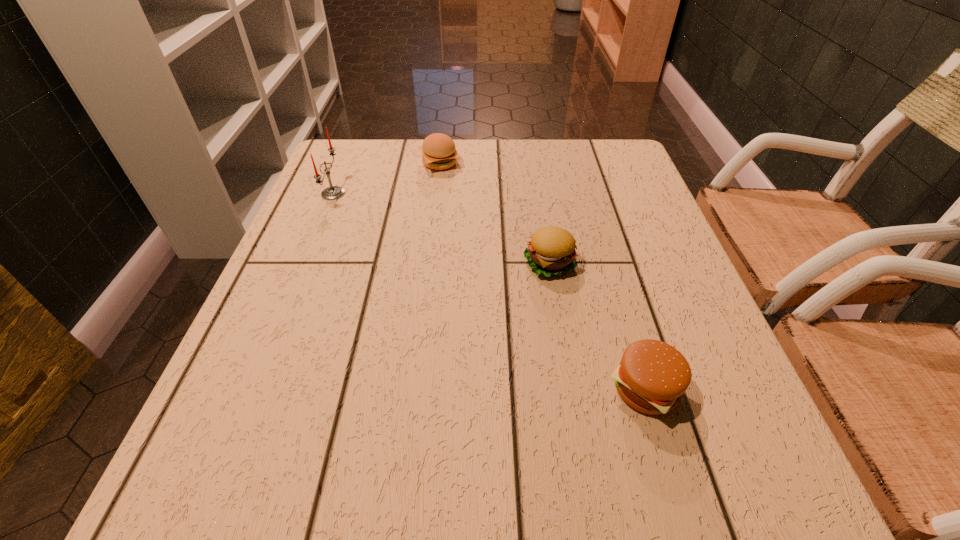
At what (x,y) coordinates should I click in order to perform the action: click on free space between the second hamburger from left to right and the nearest hamburger. Please return your answer as a coordinate pair (x, y). Looking at the image, I should click on tap(597, 326).

The width and height of the screenshot is (960, 540). I want to click on free spot between the third object from left to right and the leftmost object, so click(442, 228).

You are a GUI agent. You are given a task and a screenshot of the screen. Output one action in this format:
    pyautogui.click(x=<x>, y=<y>)
    Task: Click on the free point between the candle and the farthest object
    The image size is (960, 540).
    Given the screenshot: What is the action you would take?
    pyautogui.click(x=387, y=178)

At what (x,y) coordinates should I click in order to perform the action: click on unoccupied position between the nearest object and the second object from right to left. Please return your answer as a coordinate pair (x, y). This screenshot has height=540, width=960. Looking at the image, I should click on click(597, 326).

I want to click on the third closest object to the farthest hamburger, so click(652, 376).

Identify which object is the nearest to the farthest hamburger. Please provide its 2D coordinates. Your answer should be formatted as a tuple, i.e. [(x, y)], where the tuple contains the x and y coordinates of a point satisfying the conditions above.

[(333, 192)]

Select which hamburger is the third closest to the tallest object. Please provide its 2D coordinates. Your answer should be formatted as a tuple, i.e. [(x, y)], where the tuple contains the x and y coordinates of a point satisfying the conditions above.

[(652, 376)]

Identify which hamburger is located as the second nearest to the farthest hamburger. Please provide its 2D coordinates. Your answer should be formatted as a tuple, i.e. [(x, y)], where the tuple contains the x and y coordinates of a point satisfying the conditions above.

[(652, 376)]

You are a GUI agent. You are given a task and a screenshot of the screen. Output one action in this format:
    pyautogui.click(x=<x>, y=<y>)
    Task: Click on the free space that satisfies the following two spatial constraints: 1. on the front-facing side of the rightmost hamburger; 2. on the right side of the second farthest object
    
    Given the screenshot: What is the action you would take?
    pyautogui.click(x=253, y=388)

You are a GUI agent. You are given a task and a screenshot of the screen. Output one action in this format:
    pyautogui.click(x=<x>, y=<y>)
    Task: Click on the free space that satisfies the following two spatial constraints: 1. on the front side of the second farthest hamburger; 2. on the right side of the farthest object
    
    Given the screenshot: What is the action you would take?
    pyautogui.click(x=427, y=263)